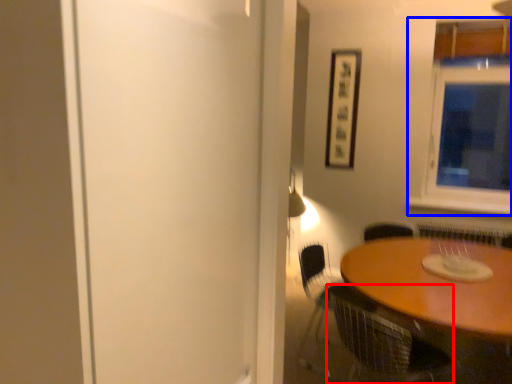
Question: Which of the following is the closest to the observer, chair (highlighted by a red box) or window (highlighted by a blue box)?

Choices:
 (A) chair
 (B) window

Answer: (A)